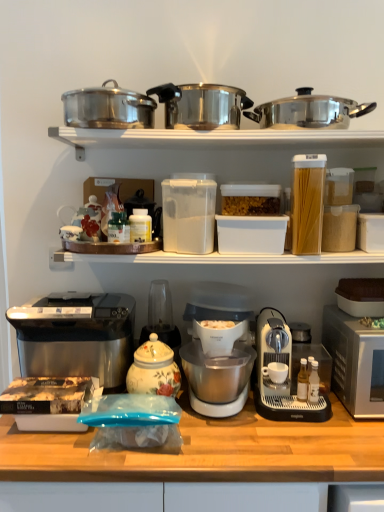
Consider the image. What is the approximate height of translucent plastic container at center?

It is 4.39 inches.

This screenshot has height=512, width=384. Describe the element at coordinates (195, 464) in the screenshot. I see `clear plastic bag at center` at that location.

This screenshot has width=384, height=512. I want to click on white matte coffee cup at center, so click(275, 372).

You are a GUI agent. You are given a task and a screenshot of the screen. Output one action in this format:
    pyautogui.click(x=<x>, y=<y>)
    Task: Click on the silver metallic microwave at right, which is counted as the first appliance, starting from the right
    Image resolution: width=384 pixels, height=512 pixels.
    Given the screenshot: What is the action you would take?
    pyautogui.click(x=355, y=362)

Looking at this image, is translucent plastic container at center oriented away from shiny metallic pot at upper left, the second kitchen appliance from the bottom?

translucent plastic container at center does not have its back to shiny metallic pot at upper left, the second kitchen appliance from the bottom.

Does translucent plastic container at center touch shiny metallic pot at upper left, the second kitchen appliance from the bottom?

No, translucent plastic container at center is not in contact with shiny metallic pot at upper left, the second kitchen appliance from the bottom.

From the image's perspective, which object appears higher, translucent plastic container at center or shiny metallic pot at upper left, positioned as the fourth kitchen appliance in right-to-left order?

shiny metallic pot at upper left, positioned as the fourth kitchen appliance in right-to-left order, appears higher in the image.

Is translucent plastic container at center bigger or smaller than shiny metallic pot at upper left, the 1th kitchen appliance positioned from the left?

In the image, translucent plastic container at center appears to be smaller than shiny metallic pot at upper left, the 1th kitchen appliance positioned from the left.

Locate an element on the screen. This screenshot has height=512, width=384. the 2nd kitchen appliance positioned above the matte brown cake pan at right, which is counted as the 3th appliance, starting from the left (from a real-world perspective) is located at coordinates (308, 110).

From a real-world perspective, between polished stainless steel pot at upper right, the 1th kitchen appliance when ordered from right to left, and matte brown cake pan at right, which is counted as the 3th appliance, starting from the left, who is vertically lower?

From a 3D spatial view, matte brown cake pan at right, which is counted as the 3th appliance, starting from the left, is below.

Is point (307, 88) closer to viewer compared to point (339, 280)?

That is True.

At what (x,y) coordinates should I click in order to perform the action: click on food that appears above the matte brown cake pan at right, which is counted as the 3th appliance, starting from the left (from the image's perspective). Please return your answer as a coordinate pair (x, y). The image size is (384, 512). Looking at the image, I should click on (250, 205).

Considering the points (242, 203) and (376, 286), which point is in front, point (242, 203) or point (376, 286)?

The point (242, 203) is closer to the camera.

Is translucent plastic container at center oriented away from matte brown cake pan at right, the 2th appliance from the right?

translucent plastic container at center is not turned away from matte brown cake pan at right, the 2th appliance from the right.

From a real-world perspective, which object rests below the other?

satin silver toaster at left.

Is shiny metallic pot at upper left, positioned as the fourth kitchen appliance in right-to-left order, bigger or smaller than satin silver toaster at left?

Clearly, shiny metallic pot at upper left, positioned as the fourth kitchen appliance in right-to-left order, is smaller in size than satin silver toaster at left.

Between shiny metallic pot at upper left, positioned as the fourth kitchen appliance in right-to-left order, and satin silver toaster at left, which one appears on the right side from the viewer's perspective?

shiny metallic pot at upper left, positioned as the fourth kitchen appliance in right-to-left order.

Is shiny metallic pot at upper left, the 1th kitchen appliance positioned from the left, outside of satin silver toaster at left?

Absolutely, shiny metallic pot at upper left, the 1th kitchen appliance positioned from the left, is external to satin silver toaster at left.

Relative to white plastic coffee maker at center, arranged as the 2th coffee maker when viewed from the right, is matte brown cake pan at right, the 2th appliance from the right, in front or behind?

In the image, matte brown cake pan at right, the 2th appliance from the right, appears behind white plastic coffee maker at center, arranged as the 2th coffee maker when viewed from the right.

Considering the positions of objects matte brown cake pan at right, which is counted as the 3th appliance, starting from the left, and white plastic coffee maker at center, arranged as the 2th coffee maker when viewed from the right, in the image provided, who is more to the left, matte brown cake pan at right, which is counted as the 3th appliance, starting from the left, or white plastic coffee maker at center, arranged as the 2th coffee maker when viewed from the right,?

Positioned to the left is white plastic coffee maker at center, arranged as the 2th coffee maker when viewed from the right.

Would you say matte brown cake pan at right, the 2th appliance from the right, contains white plastic coffee maker at center, arranged as the 2th coffee maker when viewed from the right?

That's incorrect, white plastic coffee maker at center, arranged as the 2th coffee maker when viewed from the right, is not inside matte brown cake pan at right, the 2th appliance from the right.

Would you consider matte brown cake pan at right, the 2th appliance from the right, to be distant from white plastic coffee maker at center, arranged as the 2th coffee maker when viewed from the right?

No, matte brown cake pan at right, the 2th appliance from the right, is not far from white plastic coffee maker at center, arranged as the 2th coffee maker when viewed from the right.

Between point (365, 416) and point (167, 281), which one is positioned in front?

The point (365, 416) is closer.

Does silver metallic microwave at right, arranged as the 4th appliance when viewed from the left, have a lesser height compared to porcelain floral jar at center, the 4th appliance from the right?

Correct, silver metallic microwave at right, arranged as the 4th appliance when viewed from the left, is not as tall as porcelain floral jar at center, the 4th appliance from the right.

From a real-world perspective, is silver metallic microwave at right, which is counted as the first appliance, starting from the right, located beneath porcelain floral jar at center, the 4th appliance from the right?

Yes, from a real-world perspective, silver metallic microwave at right, which is counted as the first appliance, starting from the right, is below porcelain floral jar at center, the 4th appliance from the right.

Is shiny metallic pot at upper left, positioned as the fourth kitchen appliance in right-to-left order, thinner than porcelain floral jar at center, acting as the third kitchen appliance starting from the right?

In fact, shiny metallic pot at upper left, positioned as the fourth kitchen appliance in right-to-left order, might be wider than porcelain floral jar at center, acting as the third kitchen appliance starting from the right.

Can you tell me how much shiny metallic pot at upper left, positioned as the fourth kitchen appliance in right-to-left order, and porcelain floral jar at center, which is counted as the 1th kitchen appliance, starting from the bottom, differ in facing direction?

The angular difference between shiny metallic pot at upper left, positioned as the fourth kitchen appliance in right-to-left order, and porcelain floral jar at center, which is counted as the 1th kitchen appliance, starting from the bottom, is 1.39 degrees.

Considering the sizes of objects shiny metallic pot at upper left, which ranks as the third kitchen appliance in top-to-bottom order, and porcelain floral jar at center, acting as the 4th kitchen appliance starting from the top, in the image provided, who is taller, shiny metallic pot at upper left, which ranks as the third kitchen appliance in top-to-bottom order, or porcelain floral jar at center, acting as the 4th kitchen appliance starting from the top,?

With more height is porcelain floral jar at center, acting as the 4th kitchen appliance starting from the top.

Is point (118, 116) behind point (162, 342)?

No.

At what (x,y) coordinates should I click in order to perform the action: click on food located on the right of shiny metallic pot at upper left, the 1th kitchen appliance positioned from the left. Please return your answer as a coordinate pair (x, y). Looking at the image, I should click on click(250, 205).

The image size is (384, 512). What are the coordinates of `the 2nd appliance located beneath the polished stainless steel pot at upper right, positioned as the first kitchen appliance in top-to-bottom order (from a real-world perspective)` in the screenshot? It's located at (361, 296).

From the image, which object appears to be farther from polished stainless steel pot at upper right, positioned as the first kitchen appliance in top-to-bottom order, white plastic coffee maker at center, marked as the first coffee maker in a left-to-right arrangement, or satin silver toaster at left?

satin silver toaster at left is positioned further to the anchor polished stainless steel pot at upper right, positioned as the first kitchen appliance in top-to-bottom order.

Estimate the real-world distances between objects in this image. Which object is further from white matte coffee cup at center, white plastic coffee maker at center, marked as the first coffee maker in a left-to-right arrangement, or clear plastic bag at center?

clear plastic bag at center.

Looking at the image, which one is located further to metallic pots at upper center, satin silver toaster at left or white plastic coffee maker at center, arranged as the 2th coffee maker when viewed from the right?

white plastic coffee maker at center, arranged as the 2th coffee maker when viewed from the right, is positioned further to the anchor metallic pots at upper center.

Looking at the image, which one is located further to transparent plastic container at center, which appears as the 2th appliance when viewed from the left, clear plastic bag at center or porcelain floral jar at center, which is counted as the 1th kitchen appliance, starting from the bottom?

clear plastic bag at center is positioned further to the anchor transparent plastic container at center, which appears as the 2th appliance when viewed from the left.

Consider the image. Looking at the image, which one is located further to silver metallic microwave at right, which is counted as the first appliance, starting from the right, porcelain floral jar at center, acting as the 4th kitchen appliance starting from the top, or white plastic coffee maker at center, arranged as the 2th coffee maker when viewed from the right?

porcelain floral jar at center, acting as the 4th kitchen appliance starting from the top.

Which object lies nearer to the anchor point polished stainless steel pressure cooker at upper center, which appears as the 2th kitchen appliance when viewed from the top, silver metallic microwave at right, arranged as the 4th appliance when viewed from the left, or shiny metallic pot at upper left, positioned as the fourth kitchen appliance in right-to-left order?

Among the two, shiny metallic pot at upper left, positioned as the fourth kitchen appliance in right-to-left order, is located nearer to polished stainless steel pressure cooker at upper center, which appears as the 2th kitchen appliance when viewed from the top.

Considering their positions, is white matte coffee cup at center positioned further to porcelain floral jar at center, acting as the 4th kitchen appliance starting from the top, than clear plastic bag at center?

white matte coffee cup at center lies further to porcelain floral jar at center, acting as the 4th kitchen appliance starting from the top, than the other object.

Which object lies nearer to the anchor point metallic pots at upper center, silver metallic microwave at right, which is counted as the first appliance, starting from the right, or satin silver toaster at left?

satin silver toaster at left lies closer to metallic pots at upper center than the other object.

What are the coordinates of `shelf between shiny metallic pot at upper left, positioned as the fourth kitchen appliance in right-to-left order, and clear plastic bag at center in the up-down direction` in the screenshot? It's located at (212, 138).

Identify the location of food between white plastic coffee maker at center, marked as the first coffee maker in a left-to-right arrangement, and matte brown cake pan at right, which is counted as the 3th appliance, starting from the left, in the horizontal direction. (250, 205).

Where is `coffee cup between porcelain floral jar at center, which is counted as the 1th kitchen appliance, starting from the bottom, and metallic silver coffee maker at lower right, which is the 2th coffee maker from left to right, from left to right`? coffee cup between porcelain floral jar at center, which is counted as the 1th kitchen appliance, starting from the bottom, and metallic silver coffee maker at lower right, which is the 2th coffee maker from left to right, from left to right is located at coordinates (275, 372).

The image size is (384, 512). I want to click on food between polished stainless steel pot at upper right, which is counted as the 4th kitchen appliance, starting from the left, and white matte coffee cup at center, in the vertical direction, so click(x=250, y=205).